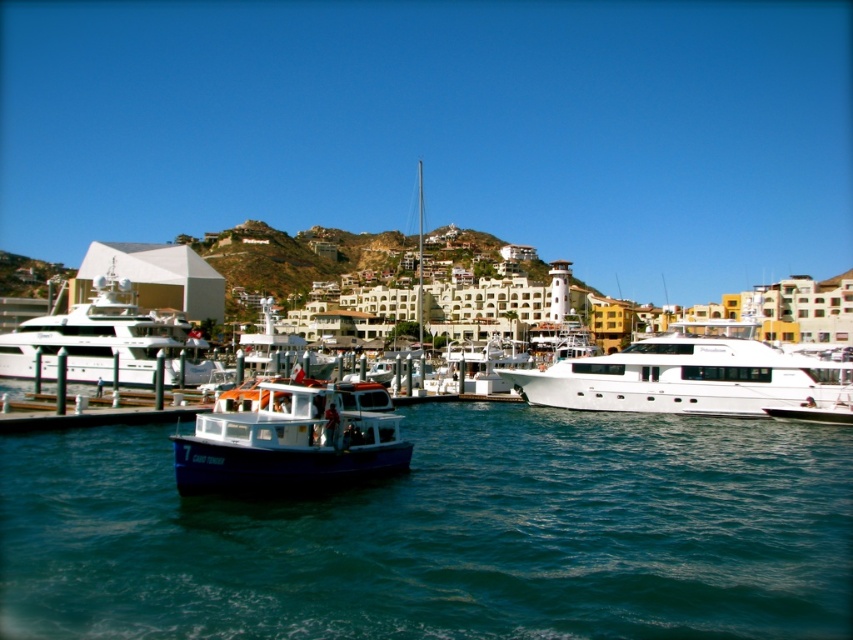
Which is more to the left, blue water at center or white glossy yacht at right?

From the viewer's perspective, blue water at center appears more on the left side.

Measure the distance from blue water at center to white glossy yacht at right.

The distance of blue water at center from white glossy yacht at right is 15.69 meters.

Describe the element at coordinates (444, 534) in the screenshot. The image size is (853, 640). I see `blue water at center` at that location.

Where is `blue water at center`? The height and width of the screenshot is (640, 853). blue water at center is located at coordinates click(x=444, y=534).

Can you confirm if blue water at center is shorter than white glossy yacht at left?

Correct, blue water at center is not as tall as white glossy yacht at left.

Is blue water at center wider than white glossy yacht at left?

Correct, the width of blue water at center exceeds that of white glossy yacht at left.

Where is `blue water at center`? The image size is (853, 640). blue water at center is located at coordinates (444, 534).

Between blue water at center and blue matte boat at center, which one is positioned higher?

→ blue matte boat at center

Is point (19, 492) closer to camera compared to point (254, 403)?

Yes, point (19, 492) is closer to viewer.

Identify the location of blue water at center. (444, 534).